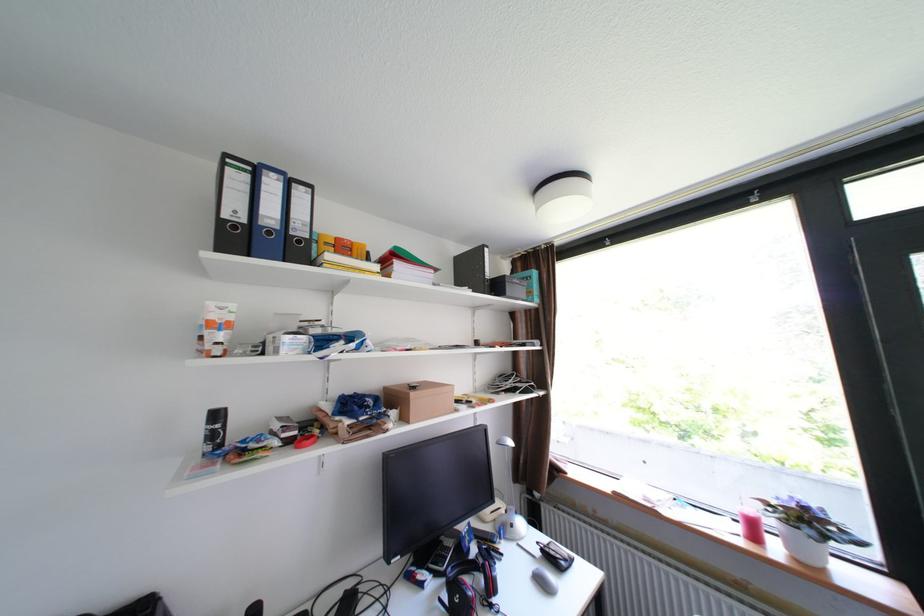
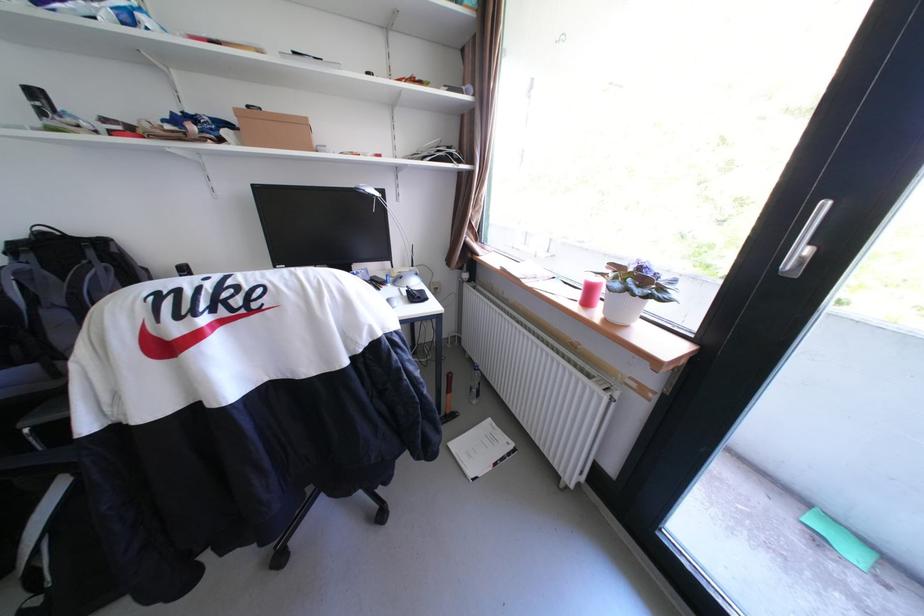
Question: I am providing you with two images of the same scene from different viewpoints. After the viewpoint changes to image2, which objects are now occluded?

Choices:
 (A) red candle
 (B) white paper booklet
 (C) red gaming headphones
 (D) sliding cabinet handle

Answer: (C)